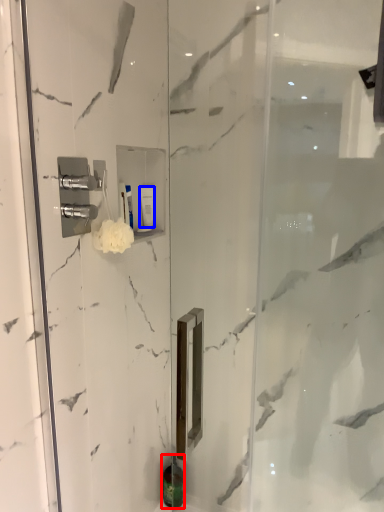
Question: Which of the following is the closest to the observer, toiletry (highlighted by a red box) or toiletry (highlighted by a blue box)?

Choices:
 (A) toiletry
 (B) toiletry

Answer: (B)